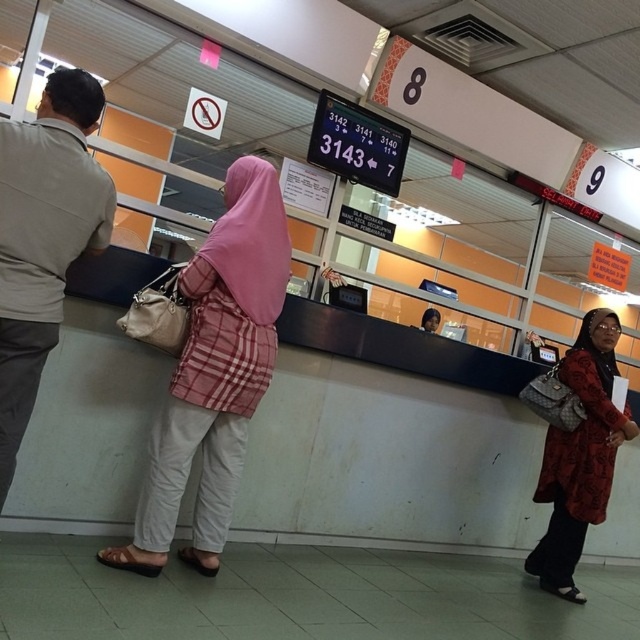
Between point (208, 492) and point (548, 371), which one is positioned in front?

Point (208, 492) is more forward.

Describe the element at coordinates (216, 372) in the screenshot. This screenshot has height=640, width=640. I see `pink fabric hijab at center` at that location.

The width and height of the screenshot is (640, 640). I want to click on pink fabric hijab at center, so click(216, 372).

Is beige cotton shirt at left bigger than red textured coat at lower right?

No.

Does point (44, 291) come closer to viewer compared to point (580, 518)?

Yes, it is.

Measure the distance between point (45, 148) and camera.

Point (45, 148) is 5.94 feet away from camera.

Find the location of a particular element. This screenshot has width=640, height=640. beige cotton shirt at left is located at coordinates (44, 237).

Between pink fabric hijab at center and beige cotton shirt at left, which one is positioned higher?

beige cotton shirt at left

Who is taller, pink fabric hijab at center or beige cotton shirt at left?

Standing taller between the two is pink fabric hijab at center.

Is point (147, 532) positioned in front of point (42, 182)?

That is False.

Locate an element on the screen. The image size is (640, 640). pink fabric hijab at center is located at coordinates (216, 372).